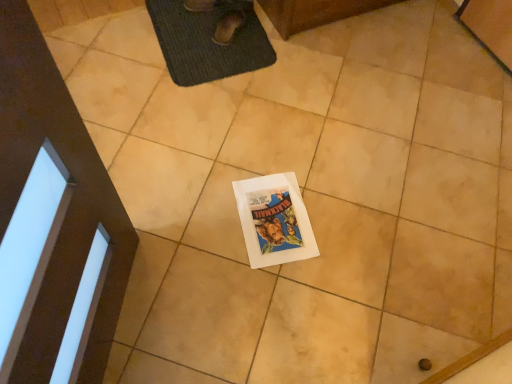
Find the location of a particular element. The height and width of the screenshot is (384, 512). free spot above white paper comic book at center (from a real-world perspective) is located at coordinates (273, 218).